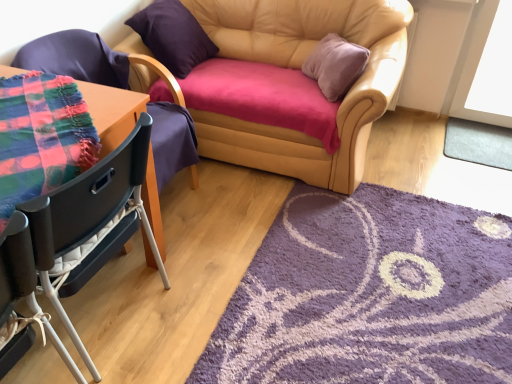
This screenshot has width=512, height=384. What do you see at coordinates (16, 266) in the screenshot? I see `white plastic chair at lower left, the first chair when ordered from front to back` at bounding box center [16, 266].

Measure the distance between point (x=360, y=167) and camera.

Point (x=360, y=167) and camera are 6.95 feet apart from each other.

In order to face purple suede pillow at upper left, should I rotate leftwards or rightwards?

It's best to rotate left around 10.638 degrees.

At what (x,y) coordinates should I click in order to perform the action: click on white plastic chair at lower left, the first chair when ordered from front to back. Please return your answer as a coordinate pair (x, y). This screenshot has width=512, height=384. Looking at the image, I should click on (16, 266).

Which of these two, matte black chair at left, the 3th chair viewed from the front, or black plastic chair at left, placed as the second chair when sorted from back to front, is bigger?

Bigger between the two is matte black chair at left, the 3th chair viewed from the front.

From a real-world perspective, between matte black chair at left, the 3th chair viewed from the front, and black plastic chair at left, arranged as the 2th chair when viewed from the front, who is vertically lower?

black plastic chair at left, arranged as the 2th chair when viewed from the front.

Is matte black chair at left, the 3th chair viewed from the front, wider than black plastic chair at left, arranged as the 2th chair when viewed from the front?

Yes.

Between point (168, 174) and point (128, 215), which one is positioned behind?

The point (168, 174) is farther from the camera.

Would you say leather couch at center is inside or outside purple shaggy rug at lower right, the 2th mat from the right?

leather couch at center is not enclosed by purple shaggy rug at lower right, the 2th mat from the right.

Who is taller, leather couch at center or purple shaggy rug at lower right, marked as the first mat in a front-to-back arrangement?

Standing taller between the two is leather couch at center.

Looking at this image, is leather couch at center aimed at purple shaggy rug at lower right, the second mat when ordered from back to front?

Yes, leather couch at center is oriented towards purple shaggy rug at lower right, the second mat when ordered from back to front.

Which of these two, leather couch at center or purple shaggy rug at lower right, the 2th mat when ordered from top to bottom, is wider?

purple shaggy rug at lower right, the 2th mat when ordered from top to bottom, is wider.

Can you tell me how much purple shaggy rug at lower right, the 2th mat when ordered from top to bottom, and black plastic chair at left, placed as the second chair when sorted from back to front, differ in facing direction?

The angle between the facing direction of purple shaggy rug at lower right, the 2th mat when ordered from top to bottom, and the facing direction of black plastic chair at left, placed as the second chair when sorted from back to front, is 0.279 degrees.

Which object is wider, purple shaggy rug at lower right, the 2th mat from the right, or black plastic chair at left, placed as the second chair when sorted from back to front?

With larger width is purple shaggy rug at lower right, the 2th mat from the right.

From the image's perspective, relative to black plastic chair at left, placed as the second chair when sorted from back to front, is purple shaggy rug at lower right, the 2th mat when ordered from top to bottom, above or below?

purple shaggy rug at lower right, the 2th mat when ordered from top to bottom, is below black plastic chair at left, placed as the second chair when sorted from back to front.

Does point (448, 368) lie in front of point (104, 163)?

No, (448, 368) is further to viewer.

This screenshot has width=512, height=384. Identify the location of the 1st chair above the purple shaggy rug at lower right, marked as the first mat in a front-to-back arrangement (from a real-world perspective). (16, 266).

From their relative heights in the image, would you say purple shaggy rug at lower right, the second mat when ordered from back to front, is taller or shorter than white plastic chair at lower left, the first chair when ordered from front to back?

In the image, purple shaggy rug at lower right, the second mat when ordered from back to front, appears to be shorter than white plastic chair at lower left, the first chair when ordered from front to back.

Is purple shaggy rug at lower right, the 2th mat when ordered from top to bottom, located outside white plastic chair at lower left, the first chair when ordered from front to back?

Indeed, purple shaggy rug at lower right, the 2th mat when ordered from top to bottom, is completely outside white plastic chair at lower left, the first chair when ordered from front to back.

Based on their sizes in the image, would you say leather couch at center is bigger or smaller than matte black chair at left, the 3th chair viewed from the front?

leather couch at center is bigger than matte black chair at left, the 3th chair viewed from the front.

How different are the orientations of leather couch at center and matte black chair at left, which ranks as the first chair in back-to-front order, in degrees?

They differ by 80.7 degrees in their facing directions.

Is leather couch at center oriented towards matte black chair at left, the 3th chair viewed from the front?

Yes.

Visually, is leather couch at center positioned to the left or to the right of matte black chair at left, which ranks as the first chair in back-to-front order?

leather couch at center is to the right of matte black chair at left, which ranks as the first chair in back-to-front order.

Consider the image. Is purple shaggy rug at lower right, the second mat when ordered from back to front, in contact with leather couch at center?

No, purple shaggy rug at lower right, the second mat when ordered from back to front, is not with leather couch at center.

Does purple shaggy rug at lower right, the 2th mat from the right, have a greater width compared to leather couch at center?

Yes, purple shaggy rug at lower right, the 2th mat from the right, is wider than leather couch at center.

Which object is closer to the camera taking this photo, purple shaggy rug at lower right, marked as the first mat in a front-to-back arrangement, or leather couch at center?

Positioned in front is purple shaggy rug at lower right, marked as the first mat in a front-to-back arrangement.

Visually, is purple shaggy rug at lower right, marked as the 1th mat in a bottom-to-top arrangement, positioned to the left or to the right of leather couch at center?

purple shaggy rug at lower right, marked as the 1th mat in a bottom-to-top arrangement, is to the right of leather couch at center.

From the picture: Is leather couch at center positioned with its back to black plastic chair at left, placed as the second chair when sorted from back to front?

No, black plastic chair at left, placed as the second chair when sorted from back to front, is not at the back of leather couch at center.

Measure the distance from leather couch at center to black plastic chair at left, arranged as the 2th chair when viewed from the front.

3.32 feet.

Is leather couch at center wider than black plastic chair at left, arranged as the 2th chair when viewed from the front?

Correct, the width of leather couch at center exceeds that of black plastic chair at left, arranged as the 2th chair when viewed from the front.

Between point (146, 54) and point (44, 261), which one is positioned behind?

The point (146, 54) is farther from the camera.

Find the location of a particular element. The image size is (512, 384). chair that is the 1st object directly below the matte black chair at left, which ranks as the first chair in back-to-front order (from a real-world perspective) is located at coordinates (86, 212).

The image size is (512, 384). What are the coordinates of `studio couch on the left of purple shaggy rug at lower right, marked as the first mat in a front-to-back arrangement` in the screenshot? It's located at (292, 84).

Considering their positions, is purple shaggy rug at lower right, the 2th mat from the right, positioned further to black plastic chair at left, placed as the second chair when sorted from back to front, than matte black chair at left, the 3th chair viewed from the front?

Based on the image, purple shaggy rug at lower right, the 2th mat from the right, appears to be further to black plastic chair at left, placed as the second chair when sorted from back to front.

Based on their spatial positions, is gray soft mat at lower right, the 2th mat positioned from the bottom, or white plastic chair at lower left, the first chair when ordered from front to back, further from purple shaggy rug at lower right, the second mat when ordered from back to front?

gray soft mat at lower right, the 2th mat positioned from the bottom, is further to purple shaggy rug at lower right, the second mat when ordered from back to front.

Based on their spatial positions, is matte black chair at left, which ranks as the first chair in back-to-front order, or black plastic chair at left, placed as the second chair when sorted from back to front, closer to white plastic chair at lower left, the third chair from the back?

black plastic chair at left, placed as the second chair when sorted from back to front.

Considering their positions, is leather couch at center positioned closer to purple shaggy rug at lower right, arranged as the first mat when viewed from the left, than matte black chair at left, which ranks as the first chair in back-to-front order?

Among the two, leather couch at center is located nearer to purple shaggy rug at lower right, arranged as the first mat when viewed from the left.

From the image, which object appears to be nearer to purple suede pillow at upper left, matte black chair at left, which ranks as the first chair in back-to-front order, or gray soft mat at lower right, the first mat viewed from the back?

Among the two, matte black chair at left, which ranks as the first chair in back-to-front order, is located nearer to purple suede pillow at upper left.

Estimate the real-world distances between objects in this image. Which object is closer to black plastic chair at left, arranged as the 2th chair when viewed from the front, matte black chair at left, which ranks as the first chair in back-to-front order, or leather couch at center?

matte black chair at left, which ranks as the first chair in back-to-front order, is closer to black plastic chair at left, arranged as the 2th chair when viewed from the front.

Which object lies nearer to the anchor point black plastic chair at left, placed as the second chair when sorted from back to front, matte black chair at left, the 3th chair viewed from the front, or gray soft mat at lower right, placed as the first mat when sorted from right to left?

matte black chair at left, the 3th chair viewed from the front, is closer to black plastic chair at left, placed as the second chair when sorted from back to front.

From the image, which object appears to be farther from matte black chair at left, the 3th chair viewed from the front, purple suede pillow at upper left or purple shaggy rug at lower right, the second mat when ordered from back to front?

Among the two, purple shaggy rug at lower right, the second mat when ordered from back to front, is located further to matte black chair at left, the 3th chair viewed from the front.

The image size is (512, 384). Identify the location of studio couch between white plastic chair at lower left, the third chair from the back, and gray soft mat at lower right, which ranks as the second mat in left-to-right order, from left to right. (292, 84).

The height and width of the screenshot is (384, 512). In order to click on studio couch located between purple suede pillow at upper left and gray soft mat at lower right, which ranks as the second mat in left-to-right order, in the left-right direction in this screenshot , I will do `click(292, 84)`.

The image size is (512, 384). Find the location of `mat located between matte black chair at left, the 3th chair viewed from the front, and gray soft mat at lower right, the second mat when ordered from front to back, in the left-right direction`. mat located between matte black chair at left, the 3th chair viewed from the front, and gray soft mat at lower right, the second mat when ordered from front to back, in the left-right direction is located at coordinates (370, 295).

Locate an element on the screen. The width and height of the screenshot is (512, 384). studio couch between purple suede pillow at upper left and black plastic chair at left, placed as the second chair when sorted from back to front, in the vertical direction is located at coordinates (292, 84).